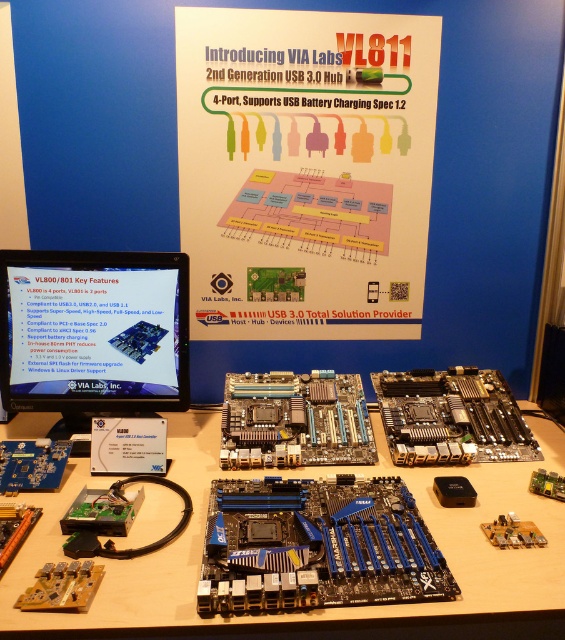
Between point (123, 257) and point (275, 545), which one is positioned in front?

Point (275, 545)

Is matte black monitor at center shorter than blue metallic motherboard at center?

→ No, matte black monitor at center is not shorter than blue metallic motherboard at center.

Is point (73, 397) more distant than point (399, 557)?

Yes, point (73, 397) is behind point (399, 557).

Locate an element on the screen. The height and width of the screenshot is (640, 565). matte black monitor at center is located at coordinates (93, 333).

Does white paper at center appear on the right side of blue printed circuit board at center?

In fact, white paper at center is to the left of blue printed circuit board at center.

Does white paper at center have a smaller size compared to blue printed circuit board at center?

Correct, white paper at center occupies less space than blue printed circuit board at center.

Is point (411, 259) positioned after point (455, 470)?

Yes.

Image resolution: width=565 pixels, height=640 pixels. What are the coordinates of `white paper at center` in the screenshot? It's located at (306, 170).

Does blue printed circuit board at center have a lesser height compared to blue metallic motherboard at center?

In fact, blue printed circuit board at center may be taller than blue metallic motherboard at center.

Which is behind, point (433, 513) or point (224, 570)?

Point (433, 513)

Where is `blue printed circuit board at center`? Image resolution: width=565 pixels, height=640 pixels. blue printed circuit board at center is located at coordinates (315, 609).